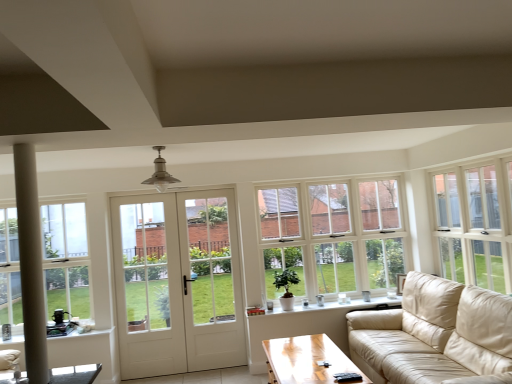
Image resolution: width=512 pixels, height=384 pixels. I want to click on empty space that is ontop of white glass door at center (from a real-world perspective), so click(x=203, y=193).